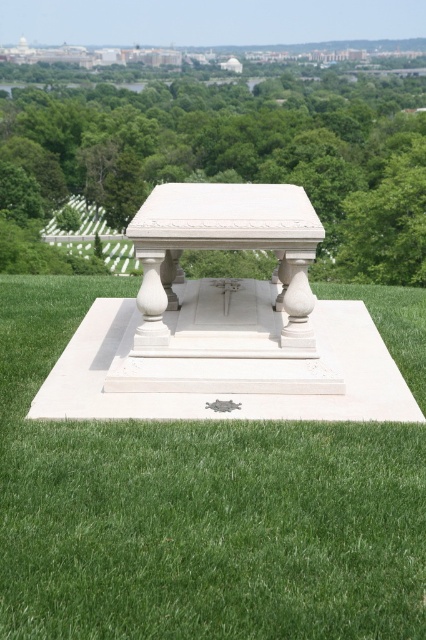
Does point (32, 456) come closer to viewer compared to point (310, 204)?

Yes, point (32, 456) is in front of point (310, 204).

Measure the distance between point (250,424) and camera.

Point (250,424) is 4.80 meters away from camera.

Measure the distance between point (305, 598) and camera.

Point (305, 598) and camera are 2.97 meters apart from each other.

Where is `green grass at center`? green grass at center is located at coordinates (195, 509).

Who is positioned more to the right, green grass at center or green leafy tree at center?

green grass at center

Can you confirm if green grass at center is positioned to the right of green leafy tree at center?

Correct, you'll find green grass at center to the right of green leafy tree at center.

Image resolution: width=426 pixels, height=640 pixels. What do you see at coordinates (195, 509) in the screenshot?
I see `green grass at center` at bounding box center [195, 509].

Where is `green grass at center`? The image size is (426, 640). green grass at center is located at coordinates (195, 509).

Does green leafy tree at center come behind white marble table at center?

Yes, it is behind white marble table at center.

I want to click on green leafy tree at center, so click(x=238, y=154).